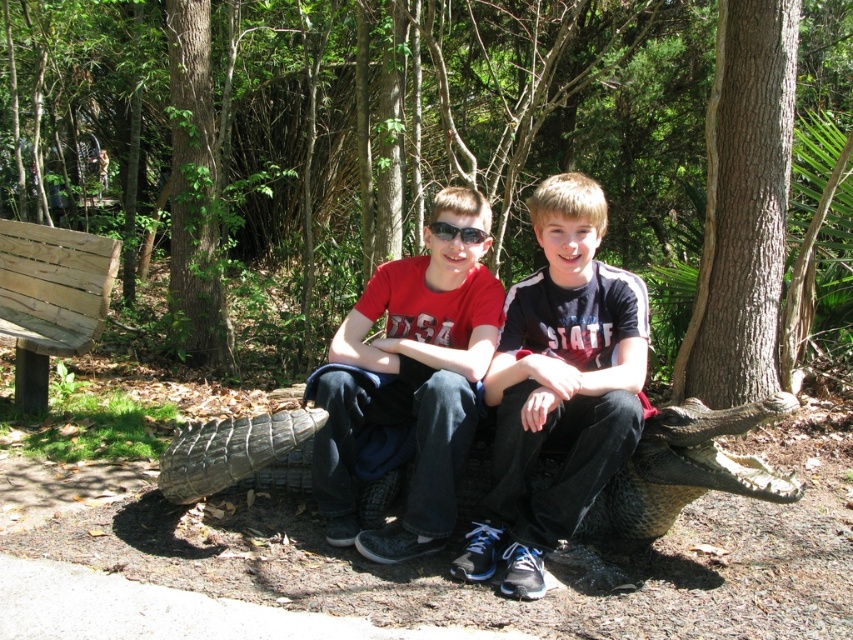
Is green textured tree at center closer to camera compared to matte black shirt at center?

No, it is not.

Which is behind, point (422, 45) or point (561, 499)?

Positioned behind is point (422, 45).

Where is `green textured tree at center`? The image size is (853, 640). green textured tree at center is located at coordinates (346, 129).

Does point (428, 332) come closer to viewer compared to point (206, 186)?

Yes, it is in front of point (206, 186).

You are a GUI agent. You are given a task and a screenshot of the screen. Output one action in this format:
    pyautogui.click(x=<x>, y=<y>)
    Task: Click on the matte red t-shirt at center
    This screenshot has height=640, width=853.
    Given the screenshot: What is the action you would take?
    pyautogui.click(x=408, y=390)

Who is taller, green textured tree at center or wooden bench at left?

wooden bench at left is taller.

Which is above, green textured tree at center or wooden bench at left?

Positioned higher is green textured tree at center.

Does point (444, 157) lie behind point (86, 316)?

Yes, point (444, 157) is behind point (86, 316).

Find the location of a particular element. Image resolution: width=853 pixels, height=640 pixels. green textured tree at center is located at coordinates (346, 129).